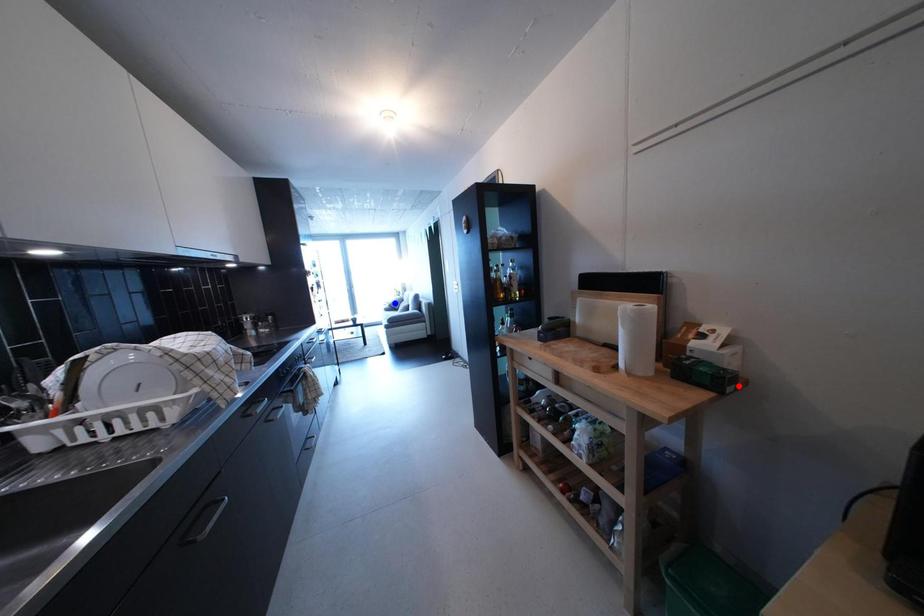
Question: In the image, two points are highlighted. Which point is nearer to the camera? Reply with the corresponding letter.

Choices:
 (A) blue point
 (B) red point

Answer: (B)